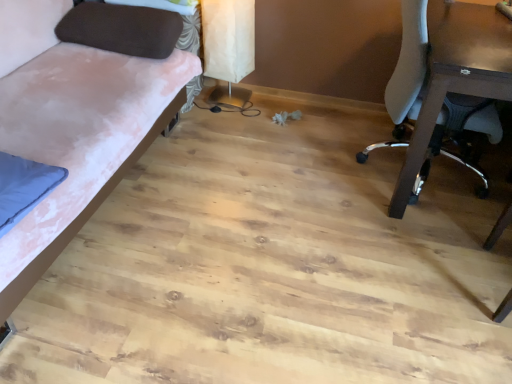
This screenshot has height=384, width=512. What do you see at coordinates (79, 141) in the screenshot?
I see `velvet pink fabric couch at left` at bounding box center [79, 141].

Describe the element at coordinates (122, 29) in the screenshot. I see `brown fabric pillow at upper left` at that location.

In order to face white mesh chair at right, should I rotate leftwards or rightwards?

Answer: Rotate right and turn 24.224 degrees.

The height and width of the screenshot is (384, 512). Find the location of `white paper lampshade at upper center`. white paper lampshade at upper center is located at coordinates (228, 46).

Considering the points (125, 7) and (420, 20), which point is in front, point (125, 7) or point (420, 20)?

Positioned in front is point (420, 20).

Is brown fabric pillow at upper left far away from white mesh chair at right?

Yes, brown fabric pillow at upper left is far from white mesh chair at right.

From a real-world perspective, is brown fabric pillow at upper left positioned above or below white mesh chair at right?

brown fabric pillow at upper left is situated higher than white mesh chair at right in the real world.

From a real-world perspective, between velvet pink fabric couch at left and white mesh chair at right, who is vertically lower?

From a 3D spatial view, velvet pink fabric couch at left is below.

Is velvet pink fabric couch at left not near white mesh chair at right?

Yes, velvet pink fabric couch at left is far from white mesh chair at right.

Find the location of a particular element. This screenshot has width=512, height=384. studio couch lying in front of the white mesh chair at right is located at coordinates (79, 141).

Does velvet pink fabric couch at left have a larger size compared to white mesh chair at right?

Yes.

Is brown fabric pillow at upper left facing away from white paper lampshade at upper center?

brown fabric pillow at upper left is not turned away from white paper lampshade at upper center.

Does point (152, 31) appear closer or farther from the camera than point (233, 102)?

Point (152, 31) appears to be closer to the viewer than point (233, 102).

Can you confirm if brown fabric pillow at upper left is smaller than white paper lampshade at upper center?

Yes, brown fabric pillow at upper left is smaller than white paper lampshade at upper center.

Which is nearer, (109, 122) or (254, 53)?

Point (109, 122).

Can you confirm if velvet pink fabric couch at left is positioned to the right of white paper lampshade at upper center?

No, velvet pink fabric couch at left is not to the right of white paper lampshade at upper center.

This screenshot has height=384, width=512. I want to click on table lamp directly beneath the velvet pink fabric couch at left (from a real-world perspective), so click(x=228, y=46).

What's the angular difference between velvet pink fabric couch at left and white paper lampshade at upper center's facing directions?

There is a 94.2-degree angle between the facing directions of velvet pink fabric couch at left and white paper lampshade at upper center.

Does white paper lampshade at upper center turn towards velvet pink fabric couch at left?

Yes, white paper lampshade at upper center is facing velvet pink fabric couch at left.

Does point (221, 62) appear closer or farther from the camera than point (15, 90)?

Point (221, 62) is farther from the camera than point (15, 90).

Is white paper lampshade at upper center placed right next to velvet pink fabric couch at left?

No, white paper lampshade at upper center is not in contact with velvet pink fabric couch at left.

Does white paper lampshade at upper center lie behind velvet pink fabric couch at left?

Yes, it is behind velvet pink fabric couch at left.

In the scene shown: From a real-world perspective, which is physically above, white mesh chair at right or velvet pink fabric couch at left?

white mesh chair at right is physically above.

You are a GUI agent. You are given a task and a screenshot of the screen. Output one action in this format:
    pyautogui.click(x=<x>, y=<y>)
    Task: Click on the studio couch to the left of white mesh chair at right
    The width and height of the screenshot is (512, 384).
    Given the screenshot: What is the action you would take?
    pyautogui.click(x=79, y=141)

From the image's perspective, does white mesh chair at right appear lower than velvet pink fabric couch at left?

No.

Does white mesh chair at right have a lesser width compared to brown fabric pillow at upper left?

Incorrect, the width of white mesh chair at right is not less than that of brown fabric pillow at upper left.

Does white mesh chair at right have a greater height compared to brown fabric pillow at upper left?

Indeed, white mesh chair at right has a greater height compared to brown fabric pillow at upper left.

From a real-world perspective, relative to brown fabric pillow at upper left, is white mesh chair at right vertically above or below?

white mesh chair at right is below brown fabric pillow at upper left.

Does white mesh chair at right turn towards brown fabric pillow at upper left?

No, white mesh chair at right does not turn towards brown fabric pillow at upper left.

You are a GUI agent. You are given a task and a screenshot of the screen. Output one action in this format:
    pyautogui.click(x=<x>, y=<y>)
    Task: Click on the chair on the right of brown fabric pillow at upper left
    Image resolution: width=512 pixels, height=384 pixels.
    Given the screenshot: What is the action you would take?
    pyautogui.click(x=442, y=78)

Image resolution: width=512 pixels, height=384 pixels. In order to click on studio couch below the white mesh chair at right (from the image's perspective) in this screenshot , I will do `click(79, 141)`.

Which object lies further to the anchor point velvet pink fabric couch at left, white paper lampshade at upper center or brown fabric pillow at upper left?

Among the two, white paper lampshade at upper center is located further to velvet pink fabric couch at left.

Estimate the real-world distances between objects in this image. Which object is further from white mesh chair at right, white paper lampshade at upper center or brown fabric pillow at upper left?

brown fabric pillow at upper left is positioned further to the anchor white mesh chair at right.

Considering their positions, is white mesh chair at right positioned closer to white paper lampshade at upper center than brown fabric pillow at upper left?

brown fabric pillow at upper left is positioned closer to the anchor white paper lampshade at upper center.

From the image, which object appears to be farther from brown fabric pillow at upper left, velvet pink fabric couch at left or white paper lampshade at upper center?

white paper lampshade at upper center lies further to brown fabric pillow at upper left than the other object.

Which object lies further to the anchor point velvet pink fabric couch at left, brown fabric pillow at upper left or white mesh chair at right?

Among the two, white mesh chair at right is located further to velvet pink fabric couch at left.

Which object lies further to the anchor point brown fabric pillow at upper left, velvet pink fabric couch at left or white mesh chair at right?

The object further to brown fabric pillow at upper left is white mesh chair at right.

Estimate the real-world distances between objects in this image. Which object is closer to brown fabric pillow at upper left, white paper lampshade at upper center or white mesh chair at right?

white paper lampshade at upper center.

Estimate the real-world distances between objects in this image. Which object is further from white paper lampshade at upper center, brown fabric pillow at upper left or white mesh chair at right?

white mesh chair at right is further to white paper lampshade at upper center.

Locate an element on the screen. This screenshot has width=512, height=384. pillow located between velvet pink fabric couch at left and white paper lampshade at upper center in the depth direction is located at coordinates (122, 29).

You are a GUI agent. You are given a task and a screenshot of the screen. Output one action in this format:
    pyautogui.click(x=<x>, y=<y>)
    Task: Click on the table lamp located between velvet pink fabric couch at left and white mesh chair at right in the left-right direction
    
    Given the screenshot: What is the action you would take?
    [228, 46]

Locate an element on the screen. table lamp between brown fabric pillow at upper left and white mesh chair at right is located at coordinates (228, 46).

At what (x,y) coordinates should I click in order to perform the action: click on pillow situated between velvet pink fabric couch at left and white mesh chair at right from left to right. Please return your answer as a coordinate pair (x, y). The height and width of the screenshot is (384, 512). Looking at the image, I should click on (122, 29).